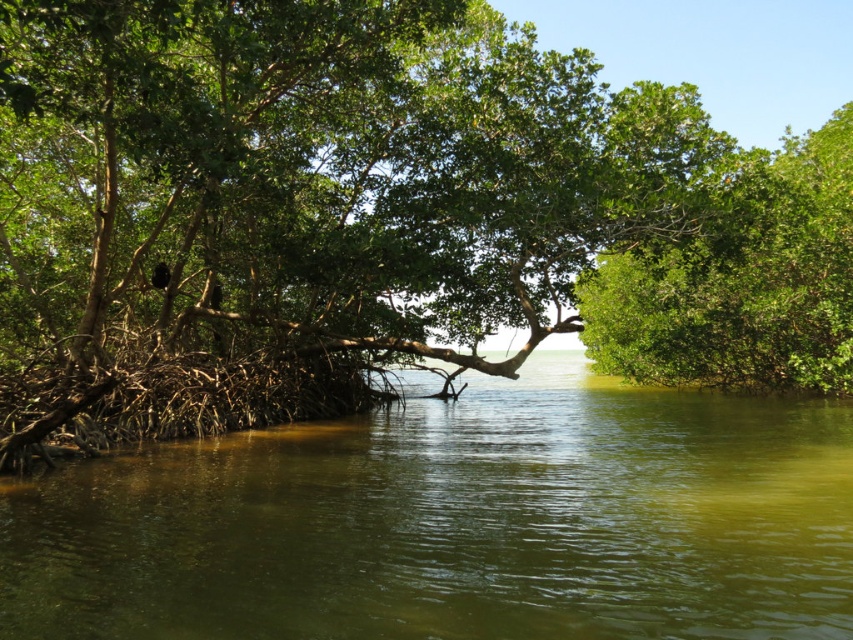
Who is more distant from viewer, (321, 166) or (631, 300)?

The point (631, 300) is behind.

Can you confirm if green leafy tree at center is bigger than green leafy tree at right?

Yes, green leafy tree at center is bigger than green leafy tree at right.

Consider the image. Measure the distance between point (508, 141) and camera.

22.68 meters

Identify the location of green leafy tree at center. This screenshot has width=853, height=640. (376, 218).

Who is more distant from viewer, (9, 237) or (364, 497)?

Point (9, 237)

Is green leafy tree at center shorter than green murky water at center?

No, green leafy tree at center is not shorter than green murky water at center.

Which is behind, point (190, 24) or point (579, 563)?

Point (190, 24)

Find the location of `green leafy tree at center`. green leafy tree at center is located at coordinates (376, 218).

Does point (451, 616) come in front of point (814, 132)?

Yes, it is.

Does green murky water at center appear on the right side of green leafy tree at right?

In fact, green murky water at center is to the left of green leafy tree at right.

Is point (444, 468) positioned in front of point (699, 269)?

Yes, it is in front of point (699, 269).

Find the location of a particular element. green murky water at center is located at coordinates (456, 522).